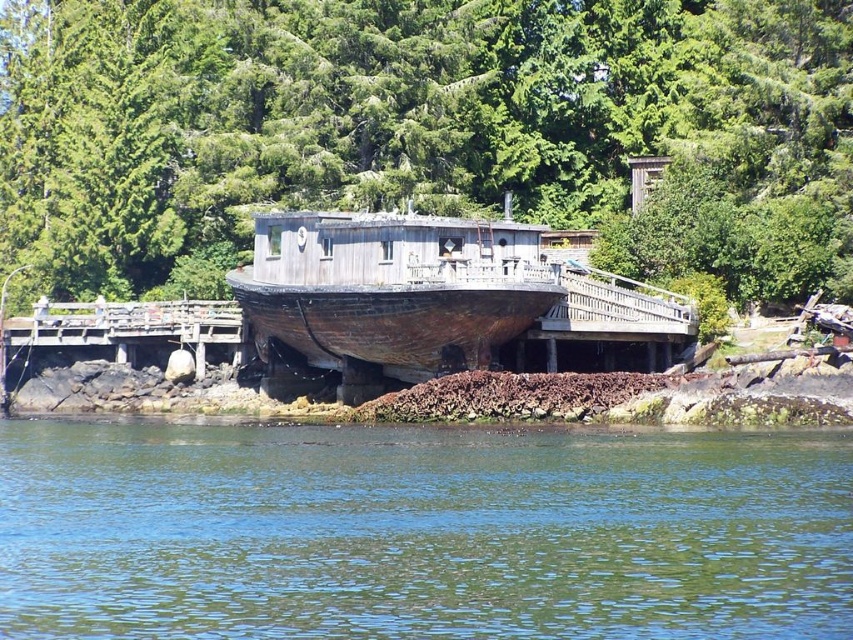
Who is more distant from viewer, (x=434, y=500) or (x=496, y=336)?

Positioned behind is point (x=496, y=336).

Is green water at lower center in front of weathered wood boat at center?

Yes, green water at lower center is in front of weathered wood boat at center.

Which is in front, point (834, 593) or point (479, 252)?

Point (834, 593) is more forward.

I want to click on green water at lower center, so click(421, 531).

Does green textured tree at upper center come behind green water at lower center?

Yes, it is behind green water at lower center.

Who is positioned more to the left, green textured tree at upper center or green water at lower center?

Positioned to the left is green textured tree at upper center.

What do you see at coordinates (416, 124) in the screenshot? I see `green textured tree at upper center` at bounding box center [416, 124].

This screenshot has height=640, width=853. Find the location of `green textured tree at upper center`. green textured tree at upper center is located at coordinates (416, 124).

Does green textured tree at upper center appear on the left side of weathered wood boat at center?

Correct, you'll find green textured tree at upper center to the left of weathered wood boat at center.

Consider the image. Is green textured tree at upper center thinner than weathered wood boat at center?

No, green textured tree at upper center is not thinner than weathered wood boat at center.

Between point (67, 51) and point (297, 266), which one is positioned behind?

The point (67, 51) is behind.

Identify the location of green textured tree at upper center. The image size is (853, 640). (416, 124).